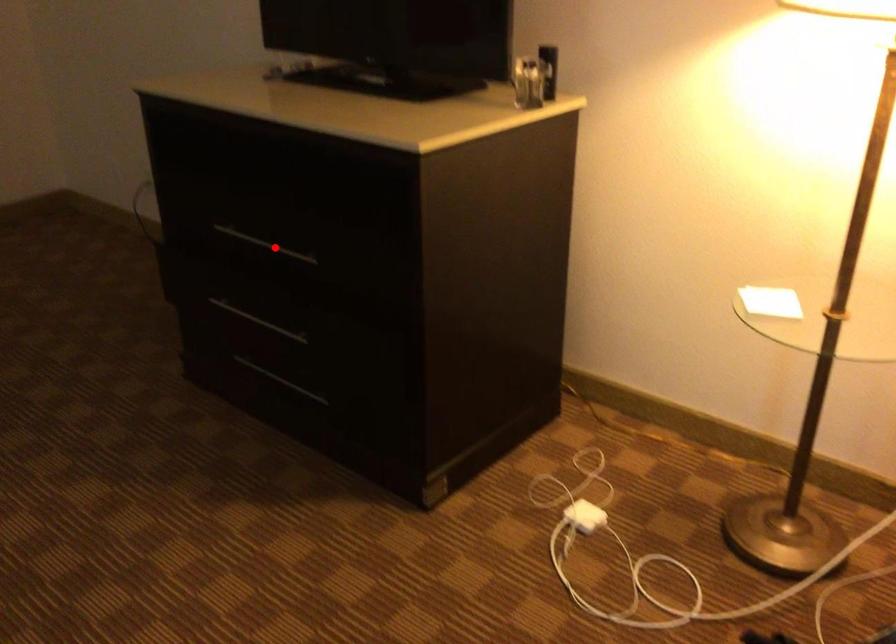
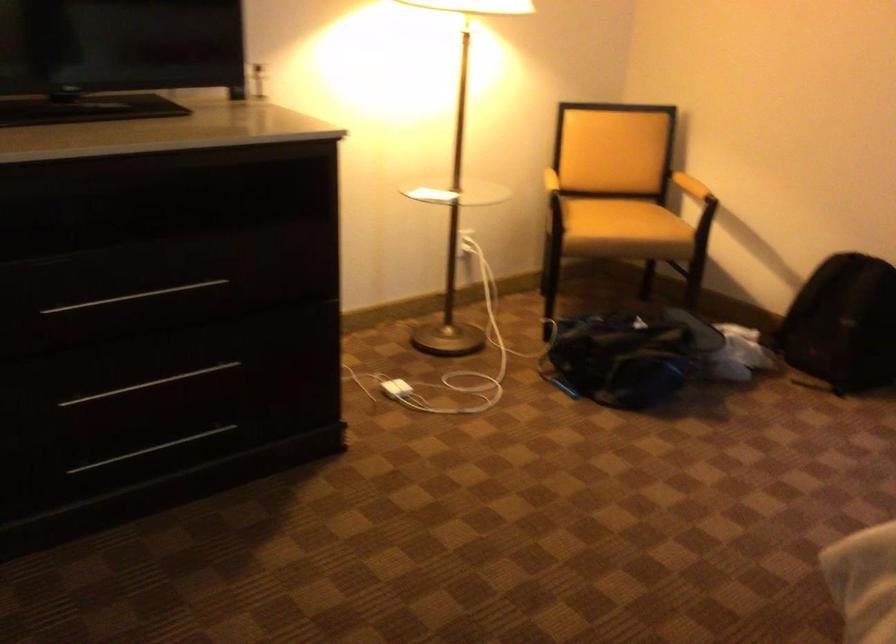
Where in the second image is the point corresponding to the highlighted location from the first image?

(134, 297)